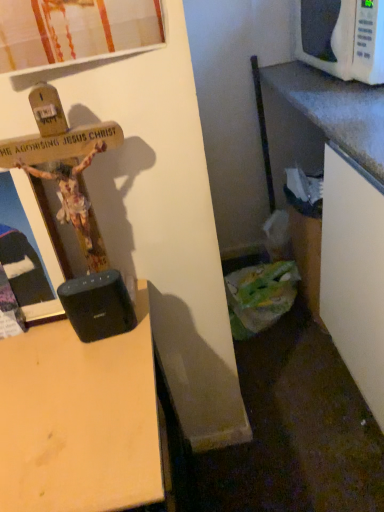
Question: Is wooden desk at center surrounding white plastic microwave at upper right?

Choices:
 (A) yes
 (B) no

Answer: (B)

Question: Is wooden desk at center bigger than white plastic microwave at upper right?

Choices:
 (A) no
 (B) yes

Answer: (B)

Question: From a real-world perspective, does wooden desk at center sit lower than white plastic microwave at upper right?

Choices:
 (A) no
 (B) yes

Answer: (B)

Question: Is wooden desk at center facing away from white plastic microwave at upper right?

Choices:
 (A) no
 (B) yes

Answer: (A)

Question: Is wooden desk at center wider than white plastic microwave at upper right?

Choices:
 (A) no
 (B) yes

Answer: (B)

Question: Is wooden desk at center not close to white plastic microwave at upper right?

Choices:
 (A) yes
 (B) no

Answer: (A)

Question: Considering the relative sizes of white plastic microwave at upper right and wooden desk at center in the image provided, is white plastic microwave at upper right taller than wooden desk at center?

Choices:
 (A) no
 (B) yes

Answer: (A)

Question: Considering the relative sizes of white plastic microwave at upper right and wooden desk at center in the image provided, is white plastic microwave at upper right smaller than wooden desk at center?

Choices:
 (A) no
 (B) yes

Answer: (B)

Question: Considering the relative sizes of white plastic microwave at upper right and wooden desk at center in the image provided, is white plastic microwave at upper right wider than wooden desk at center?

Choices:
 (A) yes
 (B) no

Answer: (B)

Question: Does white plastic microwave at upper right lie in front of wooden desk at center?

Choices:
 (A) yes
 (B) no

Answer: (B)

Question: From a real-world perspective, is white plastic microwave at upper right located beneath wooden desk at center?

Choices:
 (A) yes
 (B) no

Answer: (B)

Question: Is white plastic microwave at upper right facing away from wooden desk at center?

Choices:
 (A) yes
 (B) no

Answer: (B)

Question: From a real-world perspective, is white plastic microwave at upper right above or below wooden desk at center?

Choices:
 (A) below
 (B) above

Answer: (B)